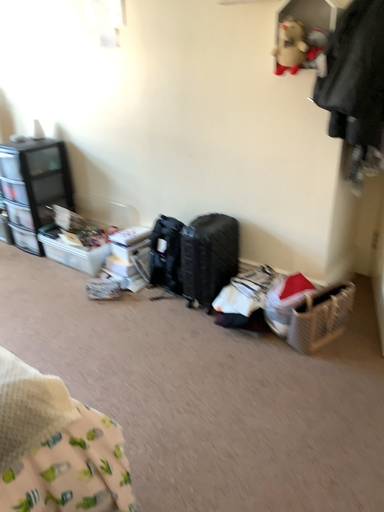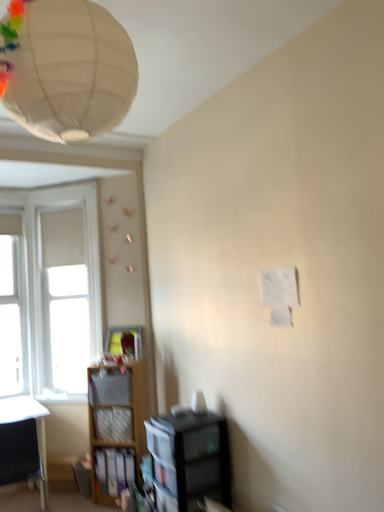
Question: How did the camera likely rotate when shooting the video?

Choices:
 (A) rotated right
 (B) rotated left

Answer: (B)